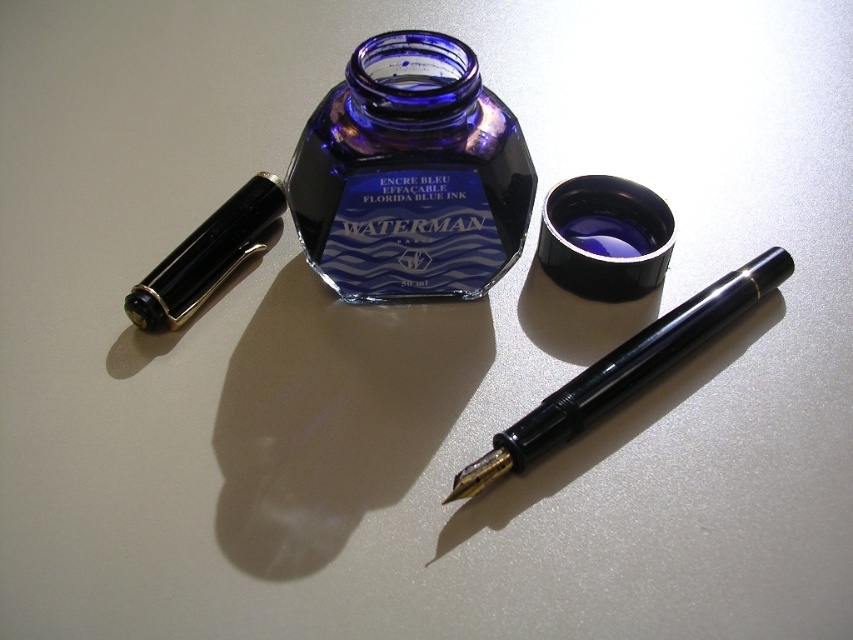
Is cobalt glass bottle at center taller than black glossy pen at center?

Yes, cobalt glass bottle at center is taller than black glossy pen at center.

Does cobalt glass bottle at center appear on the right side of black glossy pen at center?

Incorrect, cobalt glass bottle at center is not on the right side of black glossy pen at center.

This screenshot has height=640, width=853. What do you see at coordinates (410, 168) in the screenshot?
I see `cobalt glass bottle at center` at bounding box center [410, 168].

Find the location of a particular element. cobalt glass bottle at center is located at coordinates (410, 168).

Can you confirm if cobalt glass bottle at center is smaller than blue matte ink at center?

Actually, cobalt glass bottle at center might be larger than blue matte ink at center.

Where is `cobalt glass bottle at center`? The height and width of the screenshot is (640, 853). cobalt glass bottle at center is located at coordinates (410, 168).

Between black glossy pen at left and blue matte ink at center, which one appears on the left side from the viewer's perspective?

black glossy pen at left is more to the left.

Which is more to the right, black glossy pen at left or blue matte ink at center?

Positioned to the right is blue matte ink at center.

Is point (234, 195) positioned after point (363, 196)?

Yes, it is.

What are the coordinates of `black glossy pen at left` in the screenshot? It's located at (206, 257).